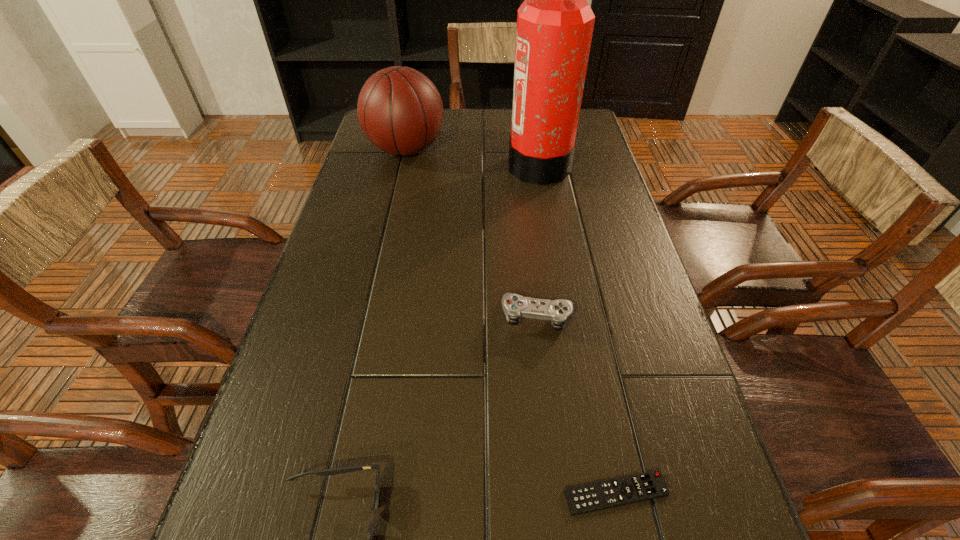
Identify the location of fire extinguisher. This screenshot has height=540, width=960. (555, 23).

The width and height of the screenshot is (960, 540). Identify the location of basketball. (400, 110).

Identify the location of control. (515, 306).

Image resolution: width=960 pixels, height=540 pixels. What are the coordinates of `the third shortest object` in the screenshot? It's located at (515, 306).

You are a GUI agent. You are given a task and a screenshot of the screen. Output one action in this format:
    pyautogui.click(x=<x>, y=<y>)
    Task: Click on the remote control
    
    Given the screenshot: What is the action you would take?
    pyautogui.click(x=605, y=494)

Where is `free spot located 0.140m on the front side of the fire extinguisher`? Image resolution: width=960 pixels, height=540 pixels. free spot located 0.140m on the front side of the fire extinguisher is located at coordinates (462, 164).

Find the location of a particular element. This screenshot has width=960, height=540. vacant region located 0.100m on the front side of the fire extinguisher is located at coordinates (475, 164).

Locate an element on the screen. The width and height of the screenshot is (960, 540). vacant area situated 0.360m on the front side of the fire extinguisher is located at coordinates (388, 164).

Image resolution: width=960 pixels, height=540 pixels. In order to click on free space located on the right of the basketball in this screenshot , I will do `click(558, 150)`.

Locate an element on the screen. The height and width of the screenshot is (540, 960). vacant space positioned on the right of the third farthest object is located at coordinates (632, 317).